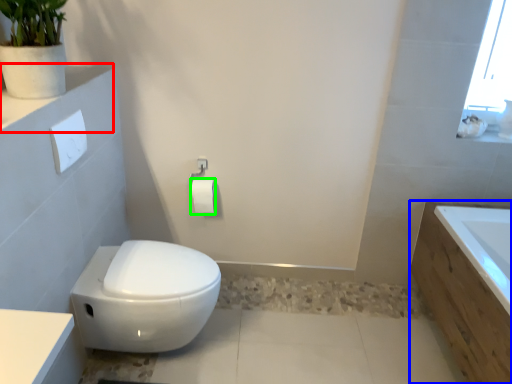
Question: Considering the real-world distances, which object is farthest from ledge (highlighted by a red box)? bath (highlighted by a blue box) or toilet paper (highlighted by a green box)?

Choices:
 (A) bath
 (B) toilet paper

Answer: (A)